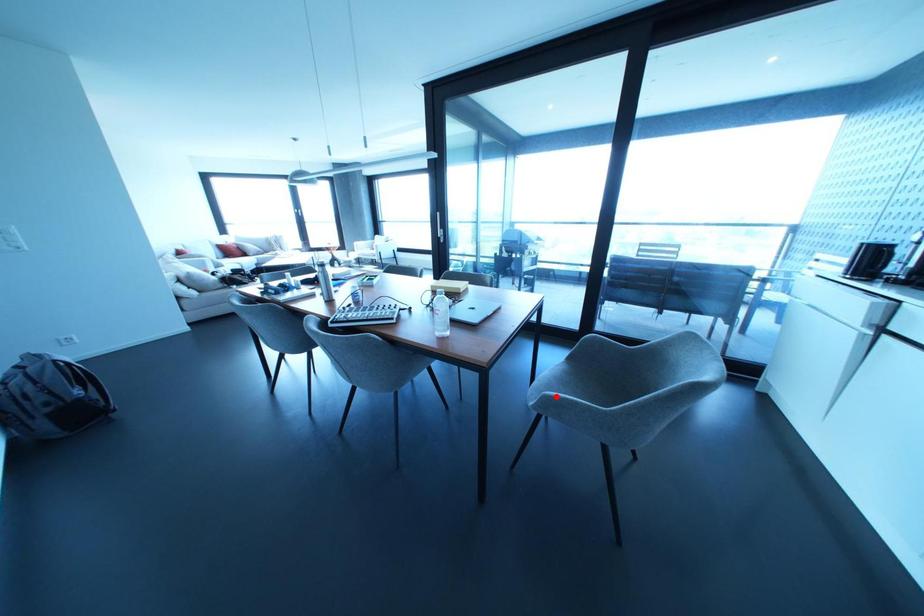
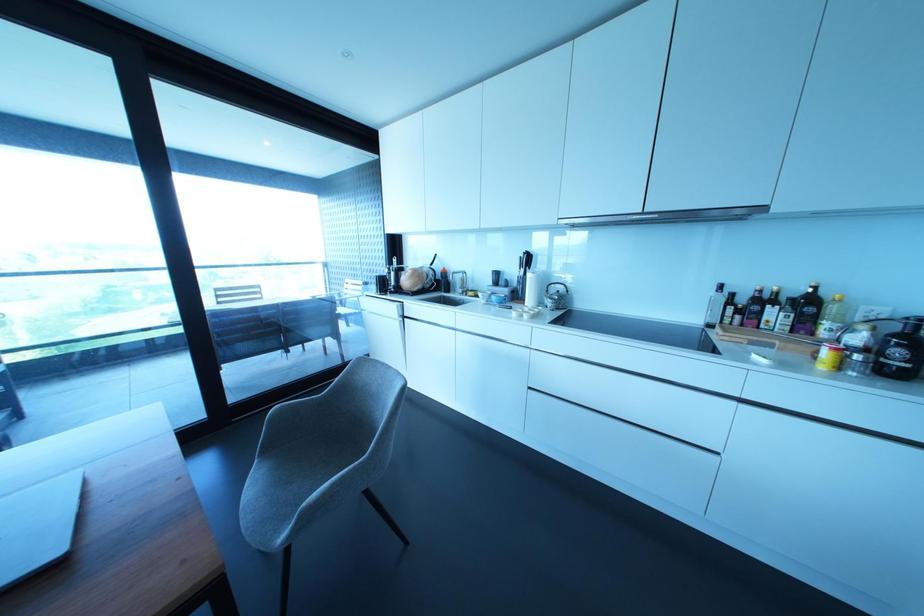
Locate, in the second image, the point that corresponds to the highlighted location in the first image.

(323, 493)